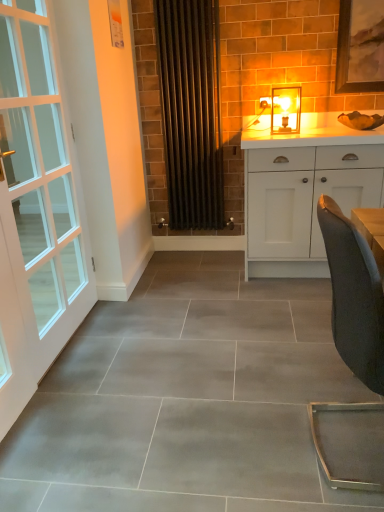
Question: From their relative heights in the image, would you say dark gray fabric chair at right is taller or shorter than white glass door at left?

Choices:
 (A) short
 (B) tall

Answer: (A)

Question: From a real-world perspective, is dark gray fabric chair at right positioned above or below white glass door at left?

Choices:
 (A) above
 (B) below

Answer: (B)

Question: Estimate the real-world distances between objects in this image. Which object is farther from the dark gray fabric chair at right?

Choices:
 (A) matte glass lampshade at upper center
 (B) white glass door at left
 (C) black metal radiator at center
 (D) white matte cabinet at right

Answer: (C)

Question: Considering the real-world distances, which object is farthest from the black metal radiator at center?

Choices:
 (A) matte glass lampshade at upper center
 (B) white glass door at left
 (C) dark gray fabric chair at right
 (D) white matte cabinet at right

Answer: (C)